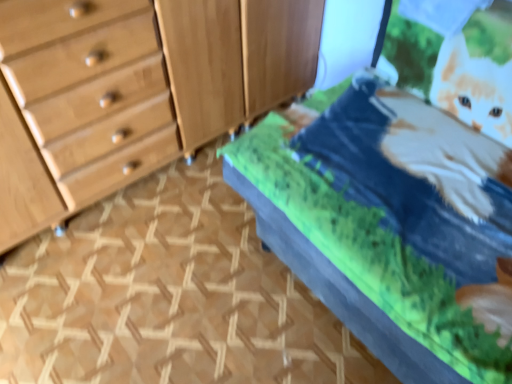
Locate an element on the screen. vacant space situated on the left part of velvet green bed at center is located at coordinates pyautogui.click(x=176, y=288).